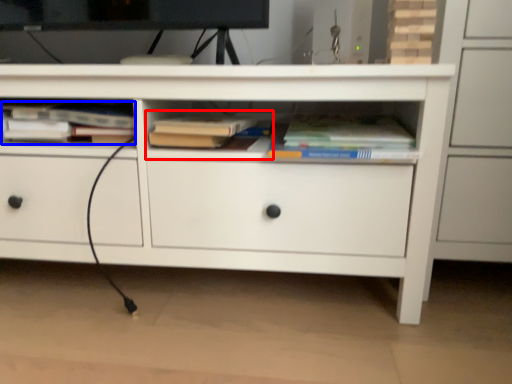
Question: Among these objects, which one is farthest to the camera, book (highlighted by a red box) or book (highlighted by a blue box)?

Choices:
 (A) book
 (B) book

Answer: (B)